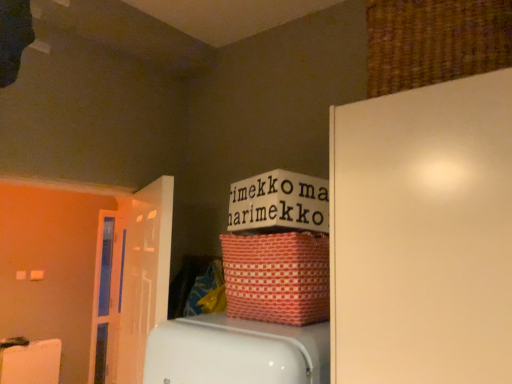
Question: Is there a large distance between woven brown basket at upper right, which is the 2th basket from left to right, and red woven basket at upper center, which is the 2th basket from right to left?

Choices:
 (A) yes
 (B) no

Answer: (B)

Question: Considering the relative sizes of woven brown basket at upper right, placed as the second basket when sorted from bottom to top, and red woven basket at upper center, arranged as the 2th basket when viewed from the top, in the image provided, is woven brown basket at upper right, placed as the second basket when sorted from bottom to top, smaller than red woven basket at upper center, arranged as the 2th basket when viewed from the top,?

Choices:
 (A) no
 (B) yes

Answer: (A)

Question: Is red woven basket at upper center, arranged as the 2th basket when viewed from the top, completely or partially inside woven brown basket at upper right, the 1th basket positioned from the right?

Choices:
 (A) no
 (B) yes

Answer: (A)

Question: Does woven brown basket at upper right, the 1th basket positioned from the right, have a larger size compared to red woven basket at upper center, placed as the 1th basket when sorted from bottom to top?

Choices:
 (A) yes
 (B) no

Answer: (A)

Question: From the image's perspective, is woven brown basket at upper right, arranged as the 1th basket when viewed from the top, located beneath red woven basket at upper center, placed as the 1th basket when sorted from bottom to top?

Choices:
 (A) yes
 (B) no

Answer: (B)

Question: Can you confirm if woven brown basket at upper right, the 1th basket positioned from the right, is wider than red woven basket at upper center, which is the 2th basket from right to left?

Choices:
 (A) yes
 (B) no

Answer: (A)

Question: Is white glossy door at left, the second door positioned from the back, taller than red woven basket at upper center, arranged as the 2th basket when viewed from the top?

Choices:
 (A) yes
 (B) no

Answer: (A)

Question: From a real-world perspective, is white glossy door at left, acting as the second door starting from the left, located beneath red woven basket at upper center, arranged as the 2th basket when viewed from the top?

Choices:
 (A) no
 (B) yes

Answer: (B)

Question: Can you confirm if white glossy door at left, the second door positioned from the back, is smaller than red woven basket at upper center, the first basket from the left?

Choices:
 (A) no
 (B) yes

Answer: (A)

Question: Is red woven basket at upper center, which is the 2th basket from right to left, at the back of white glossy door at left, the second door positioned from the back?

Choices:
 (A) yes
 (B) no

Answer: (A)

Question: Is white glossy door at left, the first door positioned from the right, not near red woven basket at upper center, arranged as the 2th basket when viewed from the top?

Choices:
 (A) yes
 (B) no

Answer: (B)

Question: From a real-world perspective, does white glossy door at left, the second door positioned from the back, stand above red woven basket at upper center, arranged as the 2th basket when viewed from the top?

Choices:
 (A) no
 (B) yes

Answer: (A)

Question: Does white glossy door at left, acting as the second door starting from the left, have a lesser height compared to woven brown basket at upper right, which is the 2th basket from left to right?

Choices:
 (A) yes
 (B) no

Answer: (B)